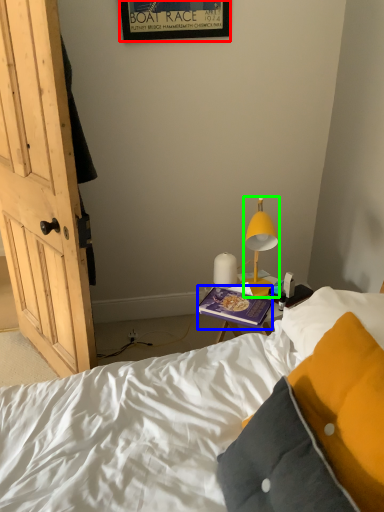
Question: Based on their relative distances, which object is farther from picture frame (highlighted by a red box)? Choose from book (highlighted by a blue box) and lamp (highlighted by a green box).

Choices:
 (A) book
 (B) lamp

Answer: (A)